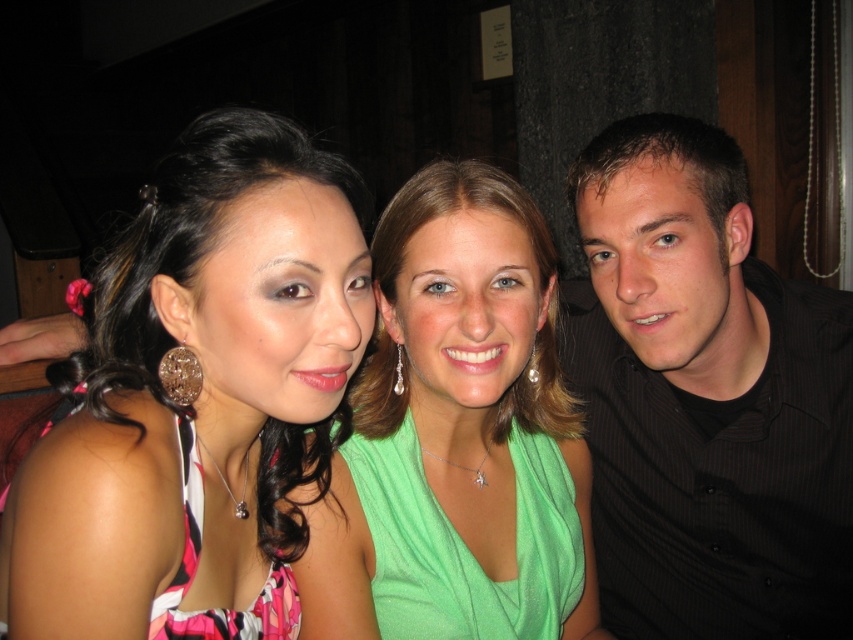
Is black striped shirt at right below green satin dress at center?

Incorrect, black striped shirt at right is not positioned below green satin dress at center.

Is black striped shirt at right taller than green satin dress at center?

Indeed, black striped shirt at right has a greater height compared to green satin dress at center.

Where is `black striped shirt at right`? This screenshot has width=853, height=640. black striped shirt at right is located at coordinates (705, 397).

Who is taller, pink printed dress at center or green satin dress at center?

green satin dress at center is taller.

Is point (132, 364) farther from viewer compared to point (398, 529)?

No.

Where is `pink printed dress at center`? This screenshot has width=853, height=640. pink printed dress at center is located at coordinates (198, 397).

Does point (158, 262) lie behind point (717, 544)?

No, (158, 262) is closer to viewer.

This screenshot has height=640, width=853. What do you see at coordinates (198, 397) in the screenshot?
I see `pink printed dress at center` at bounding box center [198, 397].

Find the location of a particular element. This screenshot has width=853, height=640. pink printed dress at center is located at coordinates (198, 397).